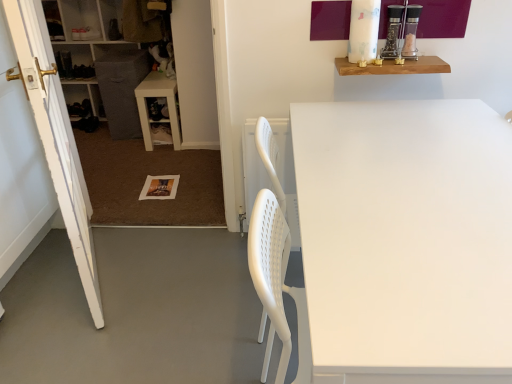
This screenshot has height=384, width=512. In order to click on free space to the left of white painted wood door at left in this screenshot , I will do `click(56, 277)`.